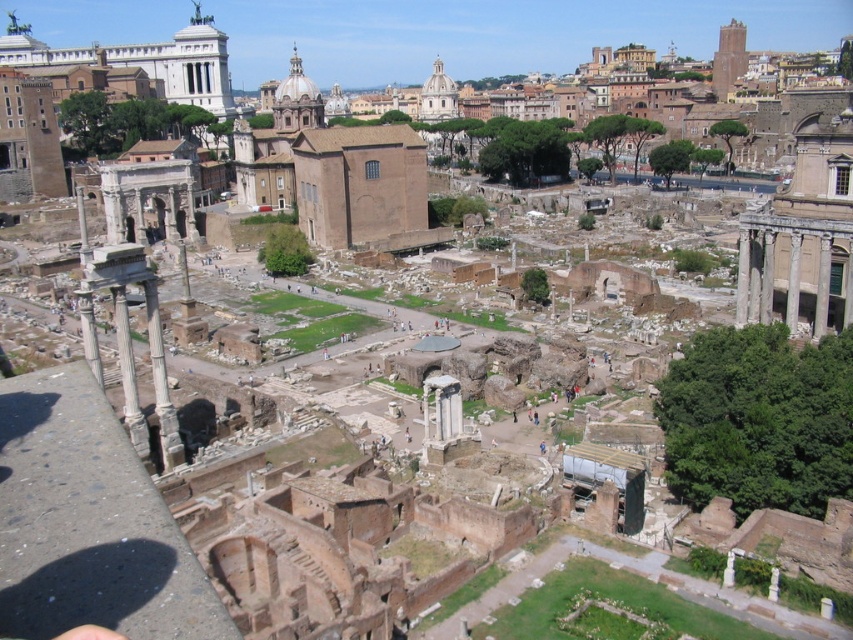
Is point (115, 296) positioned in front of point (822, 282)?

Yes.

Can you confirm if white marble column at lower left is wider than smooth stone column at right?

Yes.

Between point (122, 324) and point (819, 250), which one is positioned in front?

Point (122, 324)

Identify the location of white marble column at lower left. (128, 376).

Is smooth stone column at left positioned behind white marble column at lower left?

That is True.

Is smooth stone column at left wider than white marble column at lower left?

Incorrect, smooth stone column at left's width does not surpass white marble column at lower left's.

At what (x,y) coordinates should I click in order to perform the action: click on smooth stone column at left. Please return your answer as a coordinate pair (x, y). Looking at the image, I should click on (161, 381).

Locate an element on the screen. smooth stone column at left is located at coordinates (161, 381).

In the scene shown: Who is positioned more to the right, white marble column at lower left or smooth stone column at center right?

smooth stone column at center right is more to the right.

Image resolution: width=853 pixels, height=640 pixels. Describe the element at coordinates (128, 376) in the screenshot. I see `white marble column at lower left` at that location.

Where is `white marble column at lower left`? Image resolution: width=853 pixels, height=640 pixels. white marble column at lower left is located at coordinates (128, 376).